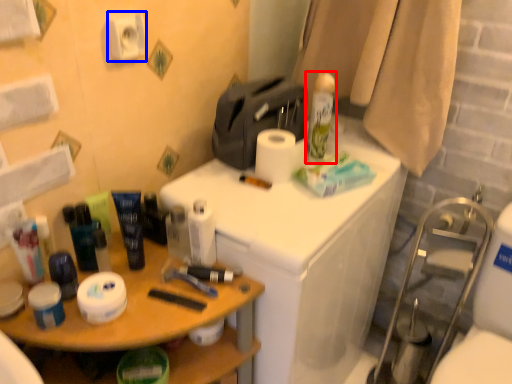
Question: Which point is closer to the camera, shaving cream (highlighted by a red box) or toilet paper (highlighted by a blue box)?

Choices:
 (A) shaving cream
 (B) toilet paper

Answer: (B)